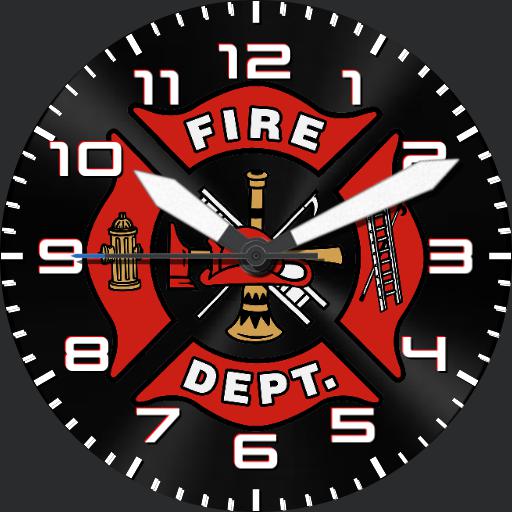
Where is `ladder`? The height and width of the screenshot is (512, 512). ladder is located at coordinates (382, 269).